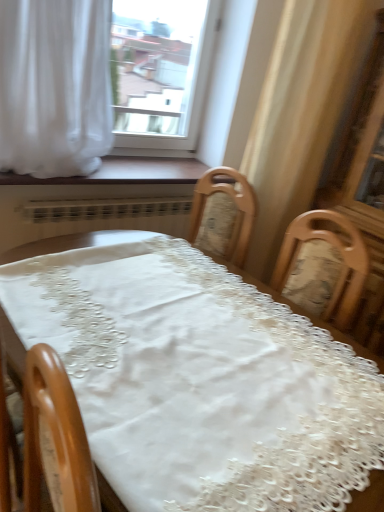
Question: Would you say white sheer curtain at upper left is part of transparent glass window at upper center's contents?

Choices:
 (A) yes
 (B) no

Answer: (B)

Question: Could you tell me if transparent glass window at upper center is facing white sheer curtain at upper left?

Choices:
 (A) no
 (B) yes

Answer: (A)

Question: Is transparent glass window at upper center thinner than white sheer curtain at upper left?

Choices:
 (A) no
 (B) yes

Answer: (B)

Question: From a real-world perspective, is transparent glass window at upper center beneath white sheer curtain at upper left?

Choices:
 (A) no
 (B) yes

Answer: (A)

Question: From the image's perspective, is transparent glass window at upper center over white sheer curtain at upper left?

Choices:
 (A) no
 (B) yes

Answer: (B)

Question: From the image's perspective, is white sheer curtain at upper left above or below white lace tablecloth at center?

Choices:
 (A) above
 (B) below

Answer: (A)

Question: From a real-world perspective, is white sheer curtain at upper left positioned above or below white lace tablecloth at center?

Choices:
 (A) above
 (B) below

Answer: (A)

Question: Would you say white sheer curtain at upper left is inside or outside white lace tablecloth at center?

Choices:
 (A) outside
 (B) inside

Answer: (A)

Question: Considering the relative positions of white sheer curtain at upper left and white lace tablecloth at center in the image provided, is white sheer curtain at upper left to the left or to the right of white lace tablecloth at center?

Choices:
 (A) right
 (B) left

Answer: (B)

Question: In terms of width, does transparent glass window at upper center look wider or thinner when compared to wooden at lower center?

Choices:
 (A) wide
 (B) thin

Answer: (B)

Question: From their relative heights in the image, would you say transparent glass window at upper center is taller or shorter than wooden at lower center?

Choices:
 (A) short
 (B) tall

Answer: (B)

Question: Is transparent glass window at upper center in front of or behind wooden at lower center in the image?

Choices:
 (A) behind
 (B) front

Answer: (A)

Question: Is transparent glass window at upper center to the left or to the right of wooden at lower center in the image?

Choices:
 (A) right
 (B) left

Answer: (A)

Question: From a real-world perspective, is white lace tablecloth at center above or below wooden at lower center?

Choices:
 (A) above
 (B) below

Answer: (B)

Question: Visually, is white lace tablecloth at center positioned to the left or to the right of wooden at lower center?

Choices:
 (A) right
 (B) left

Answer: (A)